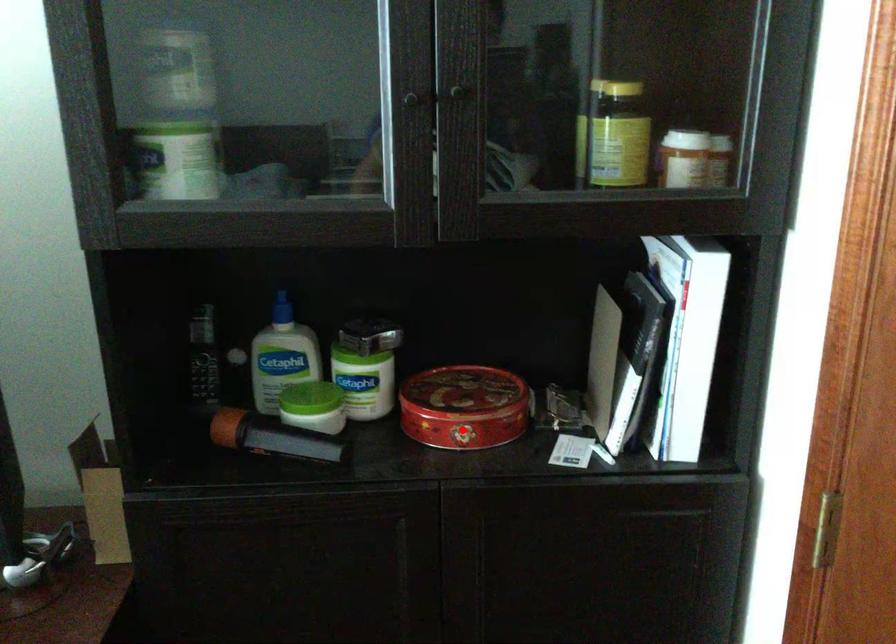
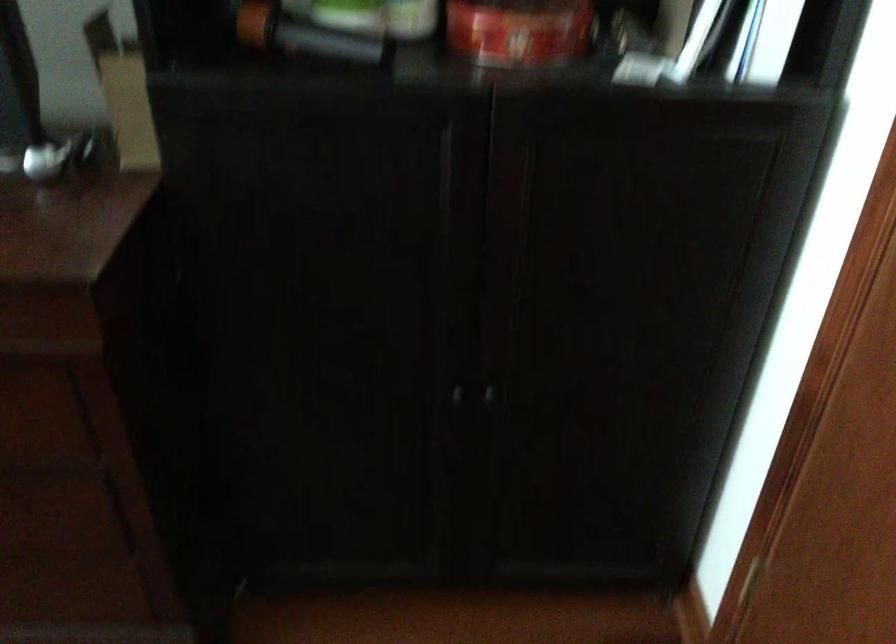
Question: I am providing you with two images of the same scene from different viewpoints. Image1 has a red point marked. In image2, the corresponding 3D location appears at what relative position? Reply with the corresponding letter.

Choices:
 (A) Closer
 (B) Farther

Answer: (A)